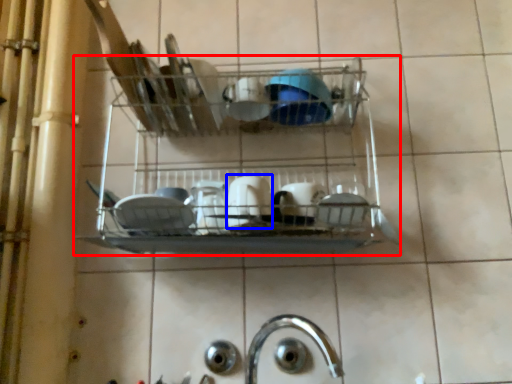
Question: Which of the following is the farthest to the observer, shelf (highlighted by a red box) or tableware (highlighted by a blue box)?

Choices:
 (A) shelf
 (B) tableware

Answer: (B)